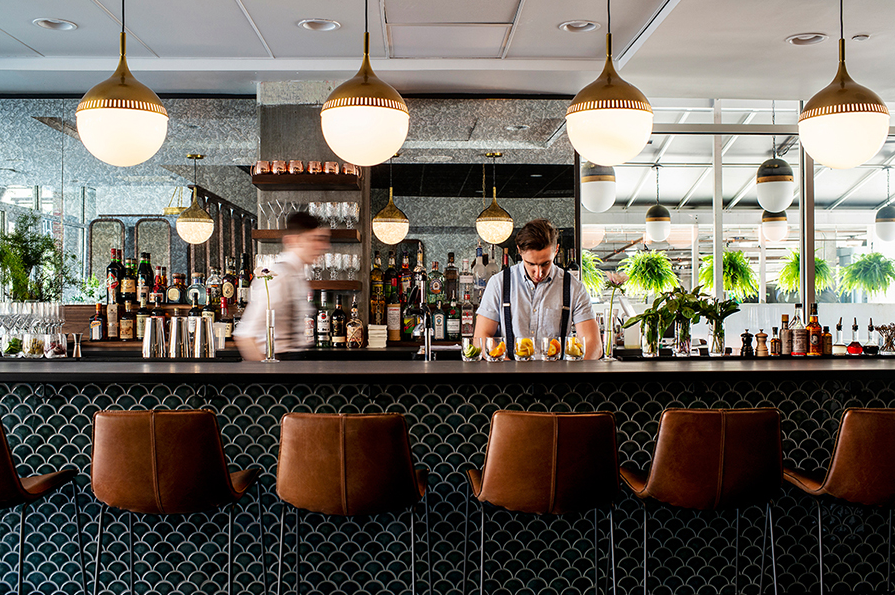
You are a GUI agent. You are given a task and a screenshot of the screen. Output one action in this format:
    pyautogui.click(x=<x>, y=<y>)
    Task: Click on the brown stools
    The height and width of the screenshot is (595, 895).
    Given the screenshot: What is the action you would take?
    pyautogui.click(x=863, y=429), pyautogui.click(x=713, y=453), pyautogui.click(x=582, y=463), pyautogui.click(x=378, y=479), pyautogui.click(x=158, y=471), pyautogui.click(x=9, y=485)